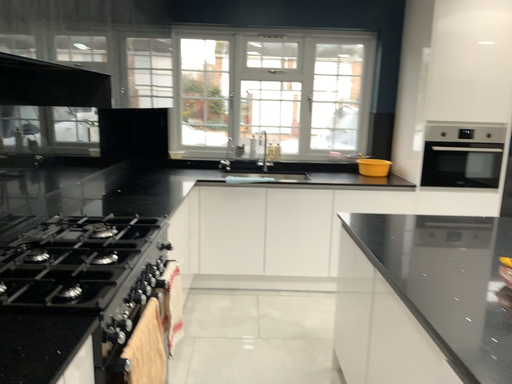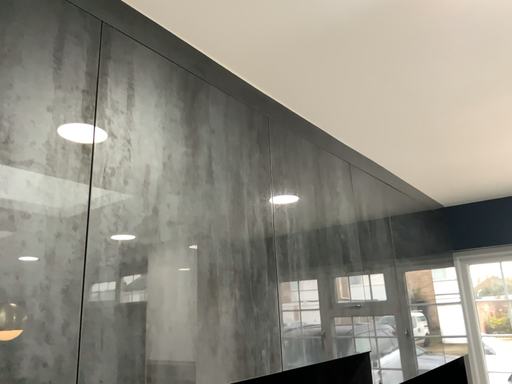
Question: How did the camera likely rotate when shooting the video?

Choices:
 (A) rotated upward
 (B) rotated downward

Answer: (A)